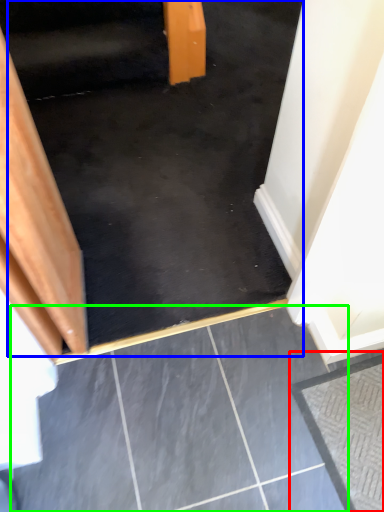
Question: Which object is positioned farthest from concrete (highlighted by a red box)? Select from stairs (highlighted by a blue box) and concrete (highlighted by a green box).

Choices:
 (A) stairs
 (B) concrete

Answer: (A)